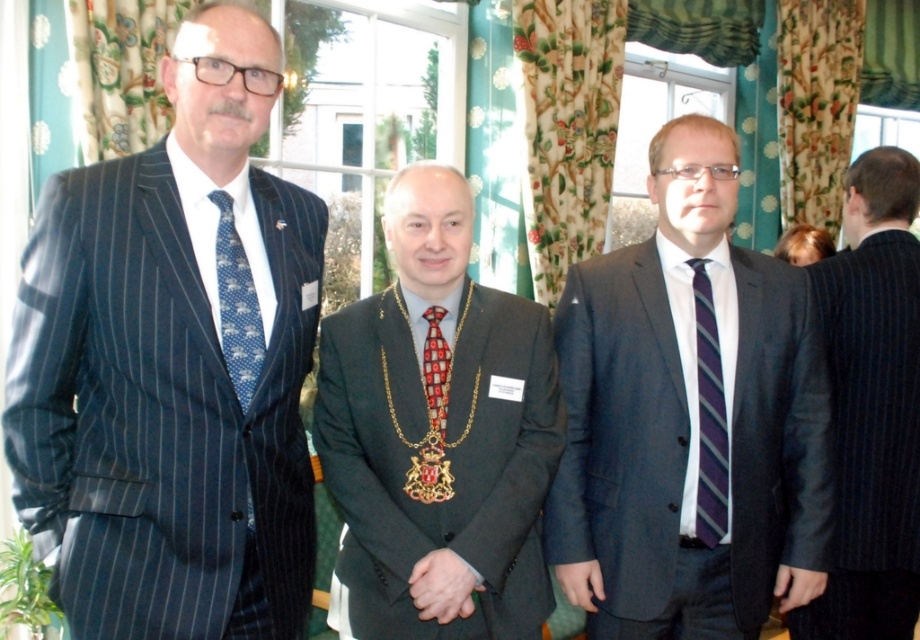
Does point (867, 476) come in front of point (230, 349)?

No, (867, 476) is further to viewer.

Is point (907, 294) farther from viewer compared to point (253, 339)?

Yes, point (907, 294) is behind point (253, 339).

Identify the location of dark pinstripe suit at right. (871, 404).

Is point (474, 502) closer to camera compared to point (256, 317)?

No.

Which is behind, point (368, 369) or point (222, 348)?

Point (368, 369)

Locate an element on the screen. This screenshot has height=640, width=920. shiny black suit at center is located at coordinates (438, 436).

Consider the image. Who is shorter, matte pinstripe suit at left or purple striped tie at center?

With less height is purple striped tie at center.

Is point (92, 236) farther from camera compared to point (710, 468)?

That is False.

Is point (265, 237) more distant than point (719, 499)?

No, (265, 237) is closer to viewer.

Locate an element on the screen. matte pinstripe suit at left is located at coordinates (173, 364).